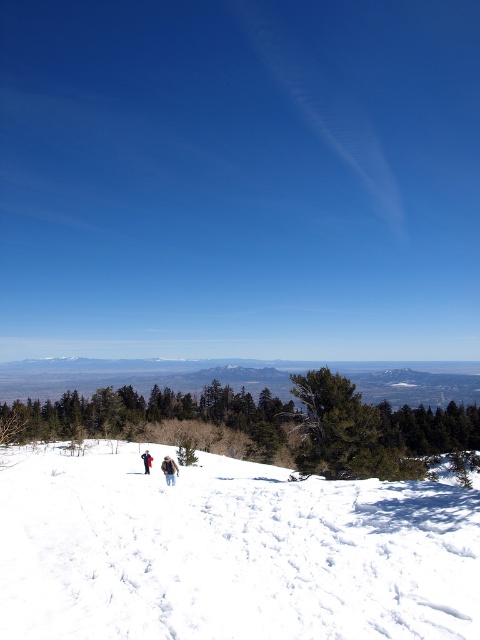
You are a photographer trying to capture both the brown fuzzy jacket at center and the brown woolen jacket at center in the same frame. Based on their heights, which jacket will appear larger in your photo?

The brown woolen jacket at center will appear larger in the photo since it is taller than the brown fuzzy jacket at center.

You are planning to build a snowman using the white powdery snow at center and wearing the brown fuzzy jacket at center. Can the snowman be built with the snow available at the center?

The white powdery snow at center might be wider than brown fuzzy jacket at center, so there is sufficient snow to build a snowman with the available snow at the center.

You are planning to build a snowman using the white powdery snow at center and the brown fuzzy jacket at center. Which object is more suitable for making the snowman?

The white powdery snow at center is more suitable for making the snowman because it has a larger size compared to the brown fuzzy jacket at center.